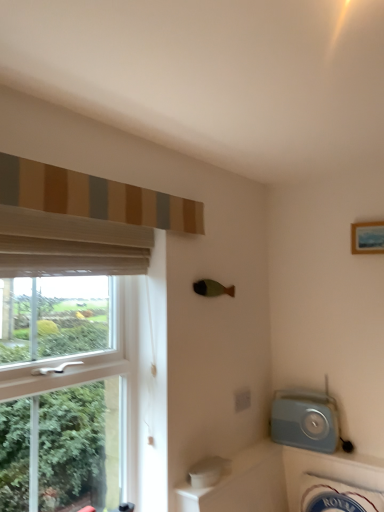
Question: Relative to white ceramic bath at lower right, is wooden framed picture at upper right in front or behind?

Choices:
 (A) behind
 (B) front

Answer: (A)

Question: Does point (365, 246) appear closer or farther from the camera than point (301, 454)?

Choices:
 (A) closer
 (B) farther

Answer: (A)

Question: Based on their relative distances, which object is nearer to the white sheer curtain at left, which is the 2th curtain from top to bottom?

Choices:
 (A) wooden framed picture at upper right
 (B) striped fabric curtain at upper left, the first curtain in the top-to-bottom sequence
 (C) white ceramic bath at lower right
 (D) matte blue radio at lower right

Answer: (B)

Question: Estimate the real-world distances between objects in this image. Which object is closer to the white ceramic bath at lower right?

Choices:
 (A) white sheer curtain at left, which is the 2th curtain from top to bottom
 (B) wooden framed picture at upper right
 (C) matte blue radio at lower right
 (D) striped fabric curtain at upper left, the first curtain in the top-to-bottom sequence

Answer: (C)